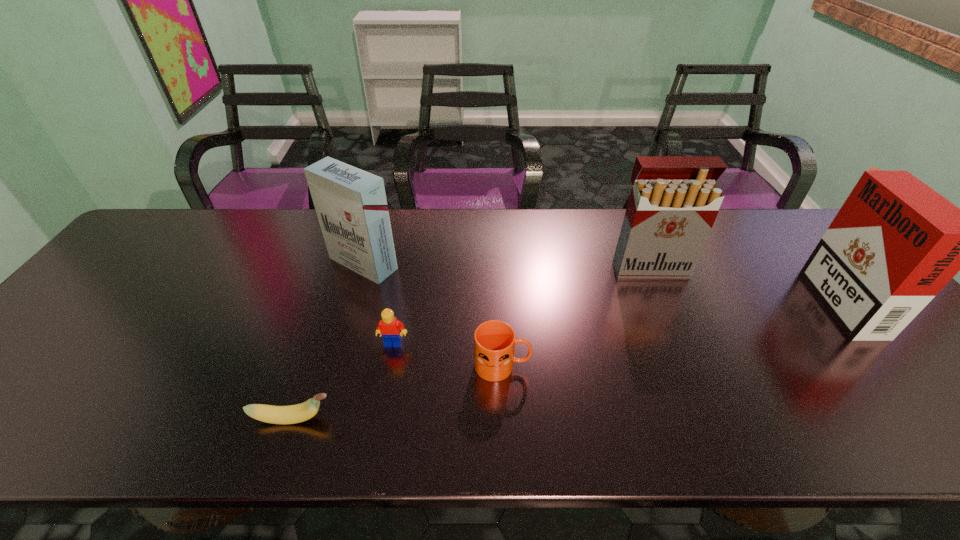
I want to click on blank area at the near edge, so click(774, 416).

The width and height of the screenshot is (960, 540). I want to click on vacant space at the left edge of the desktop, so click(x=13, y=403).

In the image, there is a desktop. What are the coordinates of `vacant space at the far left corner` in the screenshot? It's located at (154, 251).

Locate an element on the screen. This screenshot has width=960, height=540. blank area at the far right corner is located at coordinates (777, 238).

You are a GUI agent. You are given a task and a screenshot of the screen. Output one action in this format:
    pyautogui.click(x=<x>, y=<y>)
    Task: Click on the free point between the nearest object and the Lego
    This screenshot has width=960, height=540.
    Given the screenshot: What is the action you would take?
    pyautogui.click(x=344, y=381)

Where is `free area in between the fourth object from left to right and the rightmost object`? free area in between the fourth object from left to right and the rightmost object is located at coordinates (669, 331).

Where is `free space that is in between the second nearest object and the rightmost cigarette case`? free space that is in between the second nearest object and the rightmost cigarette case is located at coordinates (669, 331).

Image resolution: width=960 pixels, height=540 pixels. What are the coordinates of `vacant area between the nearest object and the rightmost object` in the screenshot? It's located at (564, 357).

The width and height of the screenshot is (960, 540). Identify the location of free spot between the second cigarette case from right to left and the rightmost cigarette case. (742, 282).

What are the coordinates of `vacant area between the Lego and the fourth object from left to right` in the screenshot? It's located at (448, 355).